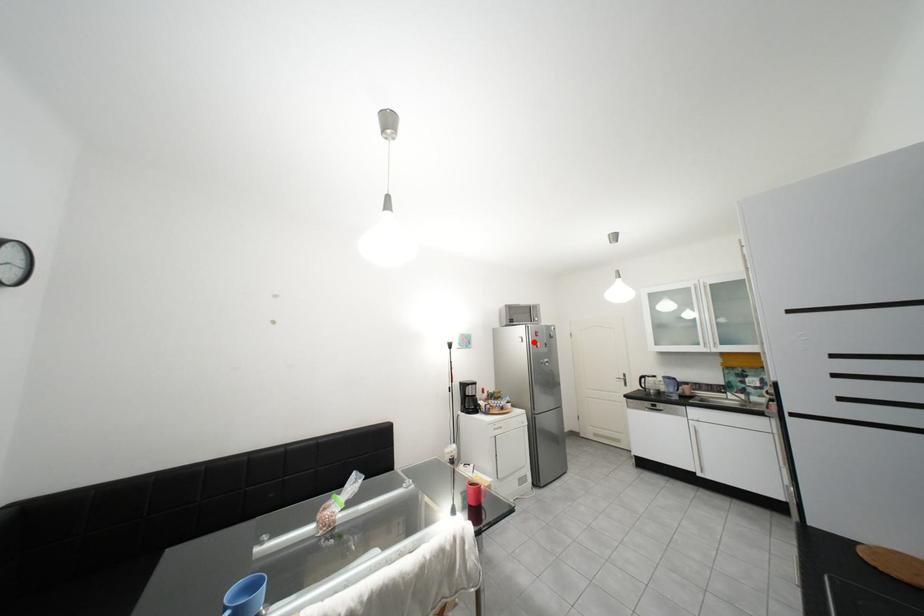
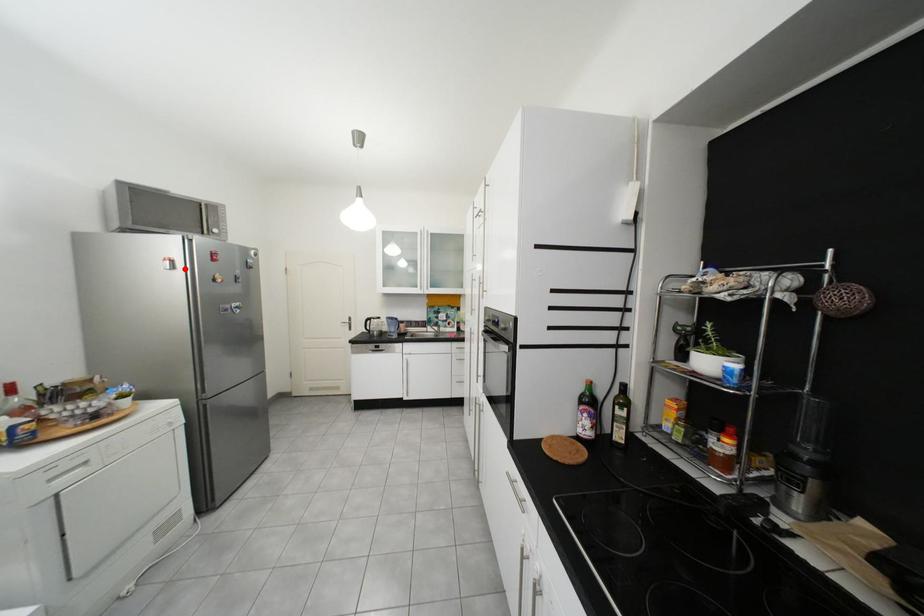
I am providing you with two images of the same scene from different viewpoints. A red point is marked on the first image and another point is marked on the second image. Does the point marked in image1 correspond to the same location as the one in image2?

Yes